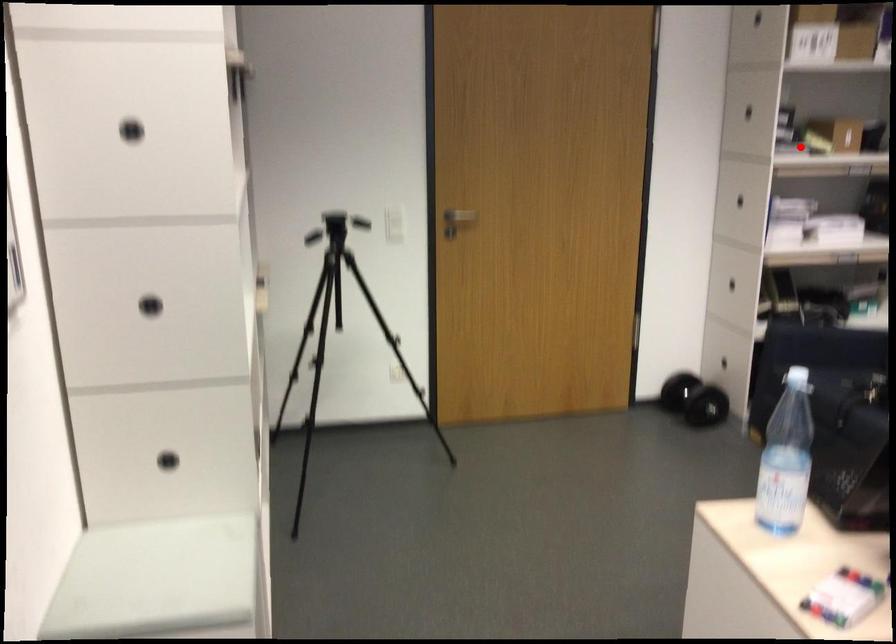
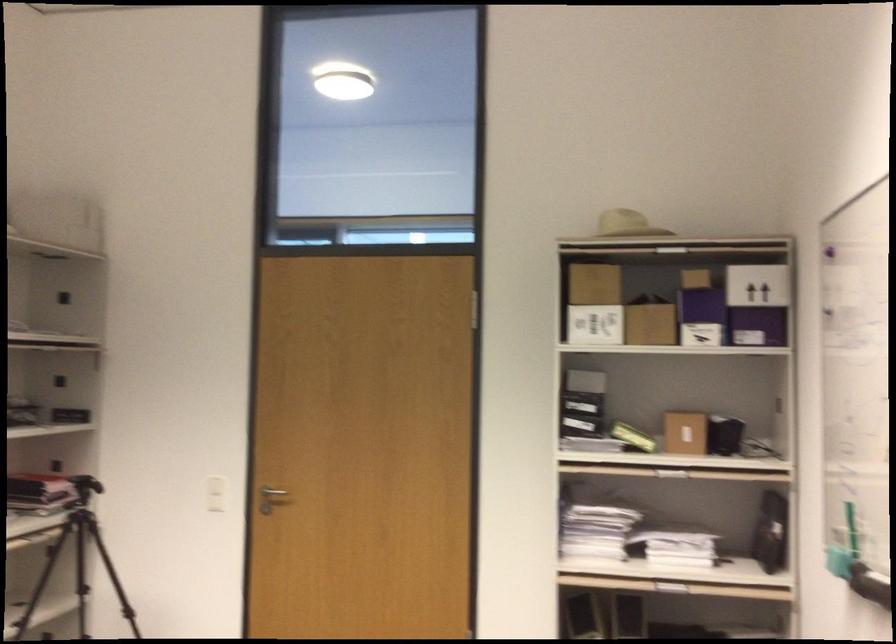
Question: I am providing you with two images of the same scene from different viewpoints. A red point is shown in image1. For the corresponding object point in image2, is it positioned nearer or farther from the camera?

Choices:
 (A) Nearer
 (B) Farther

Answer: (A)